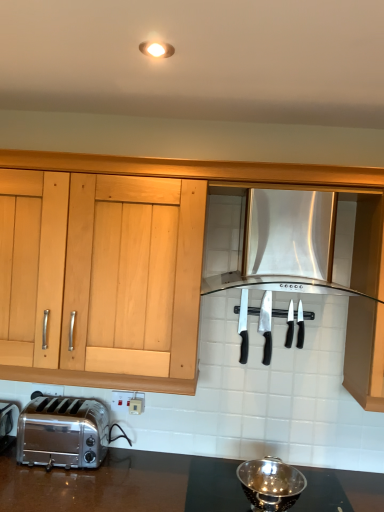
Question: In the image, is metallic reflective colander at lower center on the left side or the right side of black plastic knives at center, placed as the second silverware when sorted from right to left?

Choices:
 (A) left
 (B) right

Answer: (A)

Question: From a real-world perspective, is metallic reflective colander at lower center above or below black plastic knives at center, which is the third silverware in left-to-right order?

Choices:
 (A) below
 (B) above

Answer: (A)

Question: Which of these objects is positioned farthest from the black plastic knives at center, placed as the second silverware when sorted from right to left?

Choices:
 (A) silver metallic knife at center, which ranks as the first silverware in left-to-right order
 (B) satin silver toaster at lower left
 (C) black plastic knives at center, arranged as the 4th silverware when viewed from the left
 (D) polished stainless steel knife at center, which is counted as the 3th silverware, starting from the right
 (E) metallic reflective colander at lower center

Answer: (B)

Question: Which of these objects is positioned farthest from the silver metallic knife at center, the 4th silverware from the right?

Choices:
 (A) polished stainless steel knife at center, which is counted as the 3th silverware, starting from the right
 (B) stainless steel range hood at center
 (C) satin silver toaster at lower left
 (D) black plastic knives at center, arranged as the 4th silverware when viewed from the left
 (E) black plastic knives at center, which is the third silverware in left-to-right order

Answer: (C)